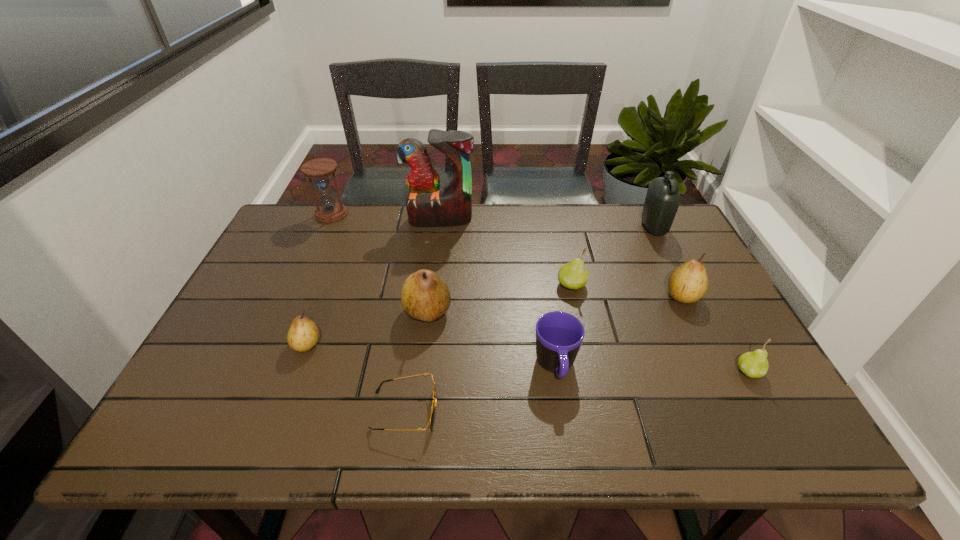
This screenshot has width=960, height=540. What are the coordinates of `free location located on the back of the left green pear` in the screenshot? It's located at [x=561, y=237].

This screenshot has width=960, height=540. Identify the location of vacant region located on the back of the leftmost brown pear. (346, 241).

Locate an element on the screen. The width and height of the screenshot is (960, 540). free space located 0.090m on the back of the smaller green pear is located at coordinates (727, 331).

Identify the location of free location located 0.120m on the front-facing side of the black sunglasses. This screenshot has width=960, height=540. (494, 411).

Where is `parrot present at the far edge`? parrot present at the far edge is located at coordinates (428, 205).

Find the location of a particular element. This screenshot has height=540, width=960. bottle that is at the far edge is located at coordinates (662, 200).

At what (x,y) coordinates should I click in order to perform the action: click on hourglass located in the far edge section of the desktop. Please return your answer as a coordinate pair (x, y). The image size is (960, 540). Looking at the image, I should click on (329, 211).

Find the location of a particular element. The image size is (960, 540). object located in the near edge section of the desktop is located at coordinates (433, 409).

This screenshot has height=540, width=960. I want to click on object located in the left edge section of the desktop, so click(x=329, y=211).

Locate an element on the screen. This screenshot has width=960, height=540. bottle that is at the right edge is located at coordinates (662, 200).